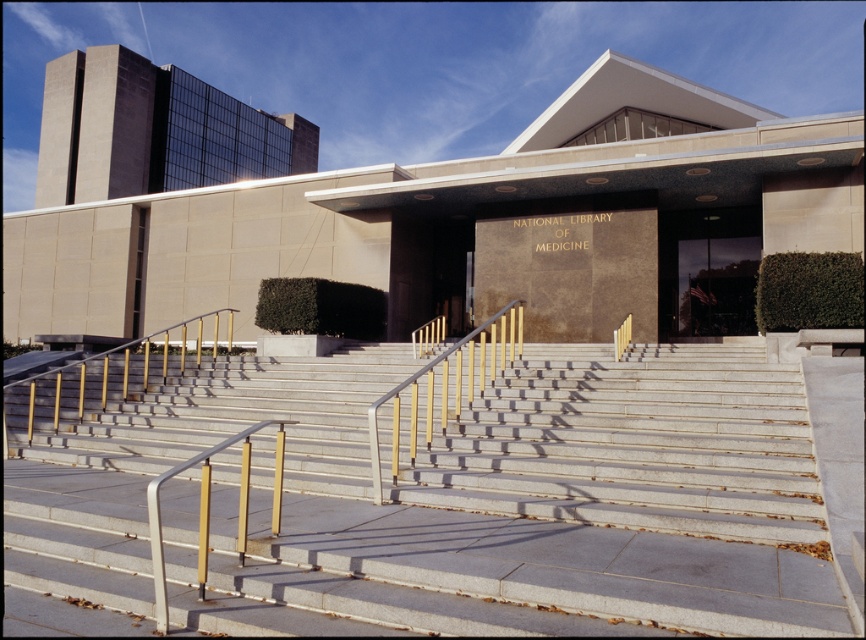
Can you confirm if glass door at center is thinner than gold metallic railing at center?

In fact, glass door at center might be wider than gold metallic railing at center.

Is glass door at center below gold metallic railing at center?

Actually, glass door at center is above gold metallic railing at center.

You are a GUI agent. You are given a task and a screenshot of the screen. Output one action in this format:
    pyautogui.click(x=<x>, y=<y>)
    Task: Click on the glass door at center
    
    Given the screenshot: What is the action you would take?
    pyautogui.click(x=708, y=269)

Does granite stairs at center come behind gold metallic handrail at lower left?

No, it is in front of gold metallic handrail at lower left.

Does point (435, 467) come in front of point (273, 509)?

No, it is not.

Image resolution: width=866 pixels, height=640 pixels. Find the location of `granite stairs at center`. granite stairs at center is located at coordinates (457, 499).

Is granite stairs at center to the left of glass door at center from the viewer's perspective?

Yes, granite stairs at center is to the left of glass door at center.

Is granite stairs at center above glass door at center?

No, granite stairs at center is not above glass door at center.

Locate an element on the screen. The height and width of the screenshot is (640, 866). granite stairs at center is located at coordinates click(x=457, y=499).

Image resolution: width=866 pixels, height=640 pixels. I want to click on granite stairs at center, so click(457, 499).